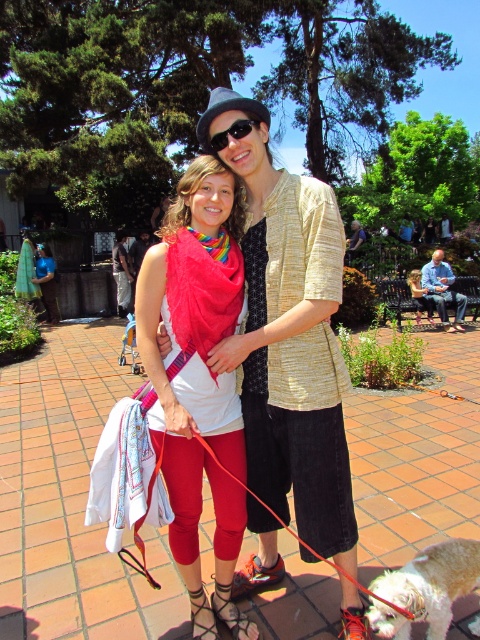
Question: Is matte red scarf at center wider than blue denim shirt at center?

Choices:
 (A) no
 (B) yes

Answer: (A)

Question: Which point appears farthest from the camera in this image?

Choices:
 (A) (311, 248)
 (B) (227, 129)

Answer: (B)

Question: Based on their relative distances, which object is nearer to the blue denim shirt at center?

Choices:
 (A) white fluffy dog at lower right
 (B) matte black hat at upper center
 (C) black plastic sunglasses at upper center
 (D) matte red scarf at center

Answer: (B)

Question: Can you confirm if matte black hat at upper center is positioned above black plastic sunglasses at upper center?

Choices:
 (A) yes
 (B) no

Answer: (B)

Question: Which of the following is the closest to the observer?

Choices:
 (A) (181, 218)
 (B) (242, 129)
 (C) (431, 628)

Answer: (B)

Question: Is matte red scarf at center positioned in front of black plastic sunglasses at upper center?

Choices:
 (A) yes
 (B) no

Answer: (A)